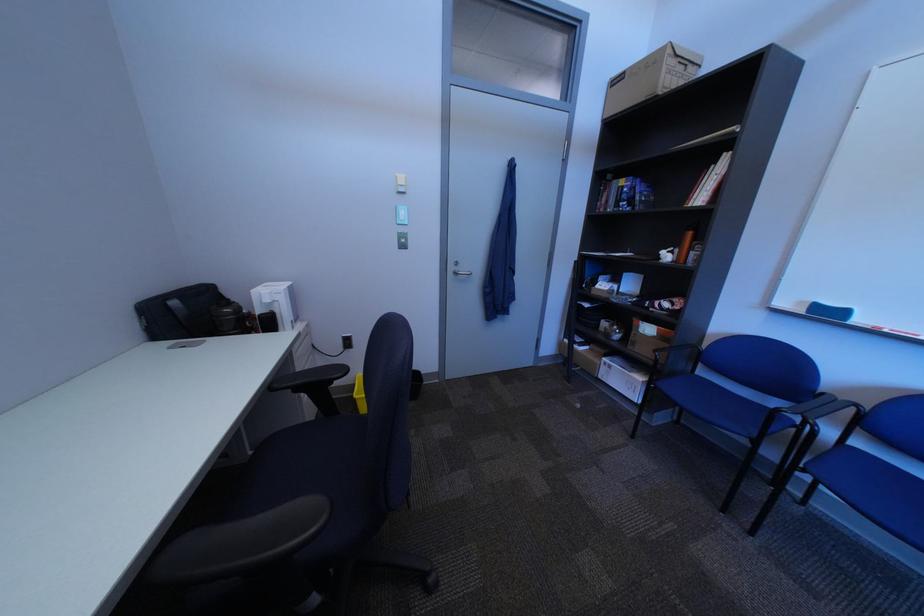
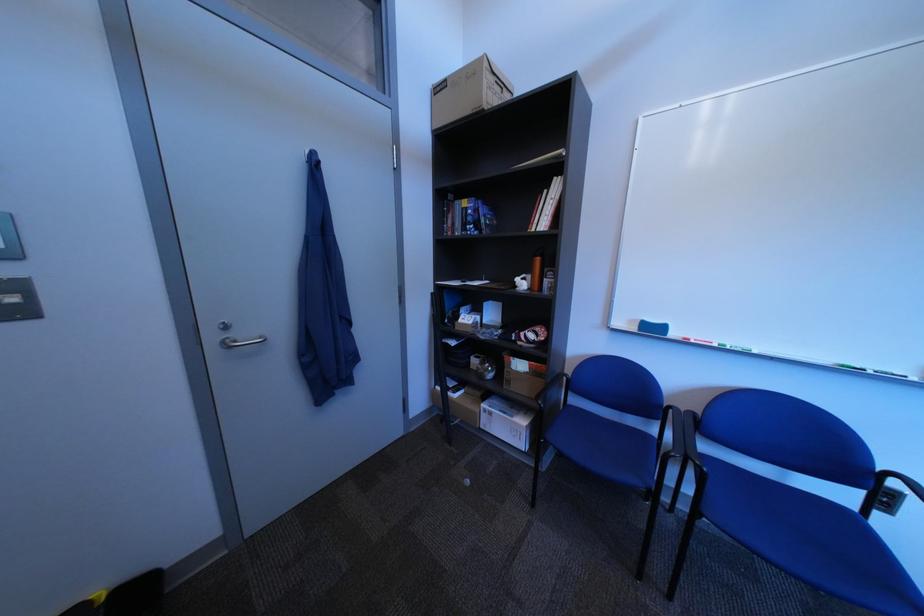
Where in the second image is the point corresponding to the point at 660,260 from the first image?

(517, 290)